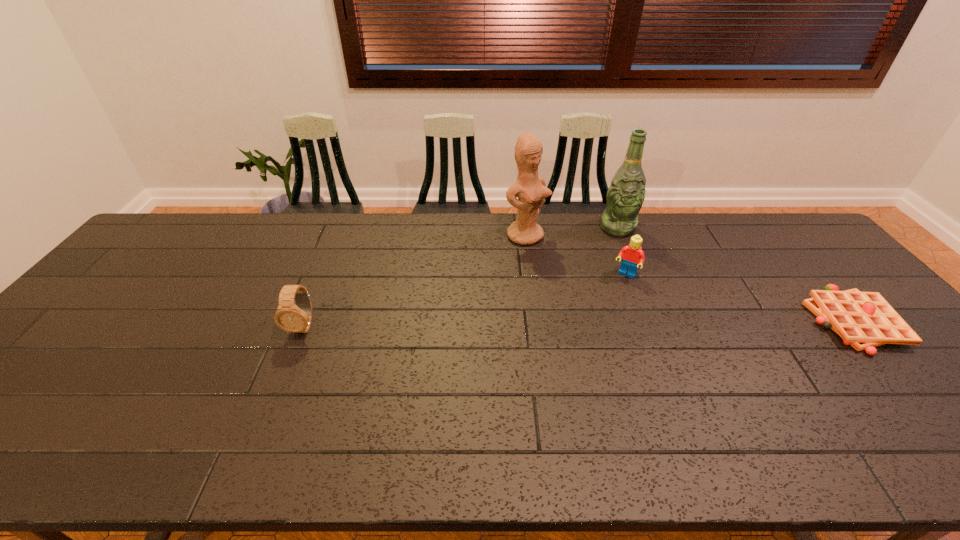
Image resolution: width=960 pixels, height=540 pixels. Find the location of `free space between the beer bottle and the shortest object`. free space between the beer bottle and the shortest object is located at coordinates (735, 274).

Where is `empty space that is in between the beer bottle and the watch`? empty space that is in between the beer bottle and the watch is located at coordinates (461, 277).

The image size is (960, 540). In order to click on free space between the beer bottle and the fourth object from right to left in this screenshot , I will do `click(571, 232)`.

Identify the location of vacant area that lies between the figurine and the shortest object. (689, 279).

At what (x,y) coordinates should I click in order to perform the action: click on object that ranks as the third closest to the beer bottle. Please return your answer as a coordinate pair (x, y). The width and height of the screenshot is (960, 540). Looking at the image, I should click on (864, 320).

Select which object is the second closest to the figurine. Please provide its 2D coordinates. Your answer should be formatted as a tuple, i.e. [(x, y)], where the tuple contains the x and y coordinates of a point satisfying the conditions above.

[(633, 254)]

This screenshot has width=960, height=540. In order to click on vacant space that satisfies the following two spatial constraints: 1. on the front side of the third nearest object; 2. on the left side of the waffle in this screenshot , I will do `click(643, 321)`.

Locate an element on the screen. The height and width of the screenshot is (540, 960). free location that satisfies the following two spatial constraints: 1. on the back side of the beer bottle; 2. on the right side of the third farthest object is located at coordinates (608, 228).

This screenshot has height=540, width=960. In order to click on vacant space that satisfies the following two spatial constraints: 1. on the front side of the shortest object; 2. on the right side of the beer bottle in this screenshot , I will do `click(656, 321)`.